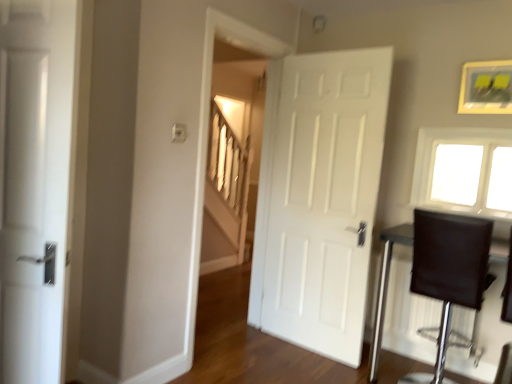
Question: In terms of height, does white matte door at center, which is the 2th door in left-to-right order, look taller or shorter compared to gold-framed picture at upper right?

Choices:
 (A) short
 (B) tall

Answer: (B)

Question: Would you say white matte door at center, the 1th door in the right-to-left sequence, is to the left or to the right of gold-framed picture at upper right in the picture?

Choices:
 (A) right
 (B) left

Answer: (B)

Question: Which object is positioned closest to the white matte door at center, the first door viewed from the back?

Choices:
 (A) white glass window at upper right
 (B) dark brown leather table at right
 (C) gold-framed picture at upper right
 (D) white matte door at left, placed as the second door when sorted from back to front

Answer: (B)

Question: Which object is the farthest from the gold-framed picture at upper right?

Choices:
 (A) white matte door at left, which is counted as the 1th door, starting from the left
 (B) dark brown leather table at right
 (C) white glass window at upper right
 (D) white matte door at center, which is the 2th door in left-to-right order

Answer: (A)